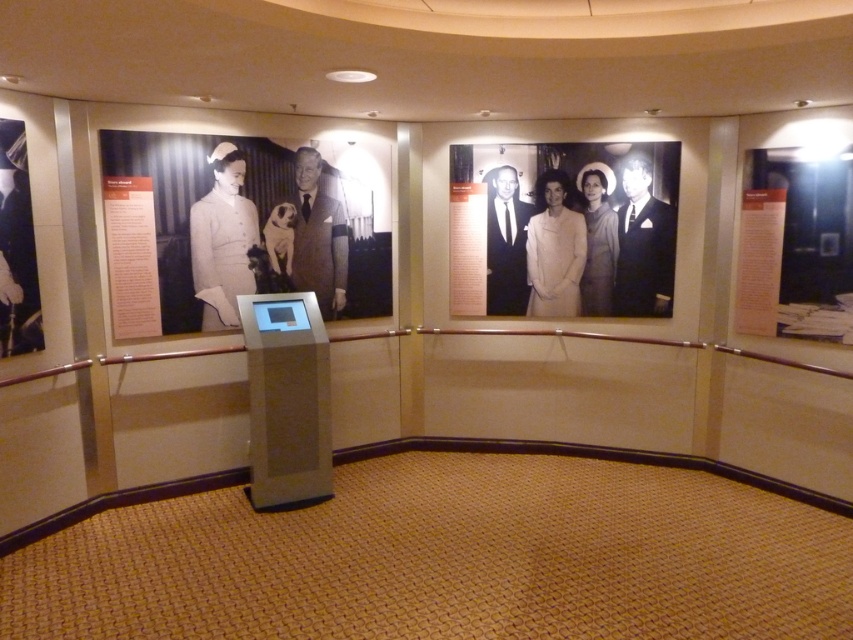
Is point (218, 253) positioned in front of point (635, 188)?

Yes.

Does white matte nurse uniform at upper left appear under black suit at upper right?

Correct, white matte nurse uniform at upper left is located below black suit at upper right.

Describe the element at coordinates (222, 241) in the screenshot. I see `white matte nurse uniform at upper left` at that location.

Locate an element on the screen. The image size is (853, 640). white matte nurse uniform at upper left is located at coordinates (x=222, y=241).

Which is below, white fabric dress at center or white paper at right?

white paper at right is below.

Who is more distant from viewer, (561,280) or (764,280)?

Point (561,280)

What are the coordinates of `white fabric dress at center` in the screenshot? It's located at (554, 250).

From the picture: Who is taller, black glossy poster at center or smooth beige suit at center?

black glossy poster at center is taller.

Which is above, black glossy poster at center or smooth beige suit at center?

Positioned higher is black glossy poster at center.

Measure the distance between black glossy poster at center and camera.

black glossy poster at center and camera are 4.09 meters apart from each other.

Locate an element on the screen. black glossy poster at center is located at coordinates (563, 228).